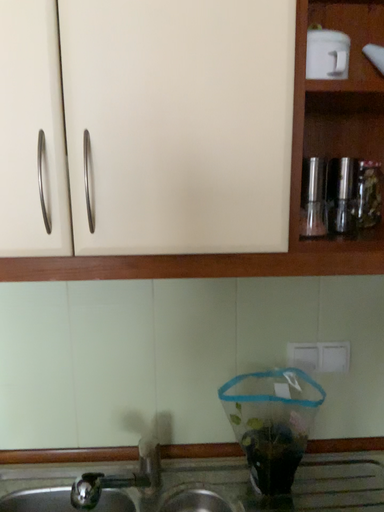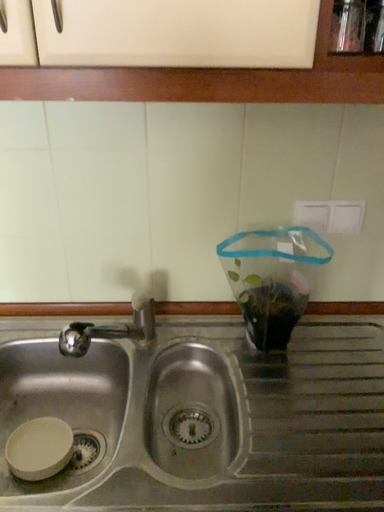
Question: How did the camera likely rotate when shooting the video?

Choices:
 (A) rotated downward
 (B) rotated upward

Answer: (A)